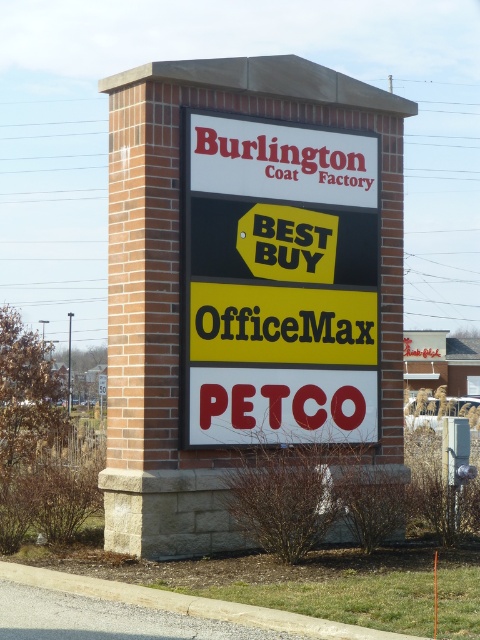
Does brick sign at center appear on the left side of white plastic sign at center?

Yes, brick sign at center is to the left of white plastic sign at center.

Is brick sign at center positioned before white plastic sign at center?

Yes, it is.

Is point (116, 268) closer to camera compared to point (304, 227)?

Yes.

Identify the location of brick sign at center. (245, 284).